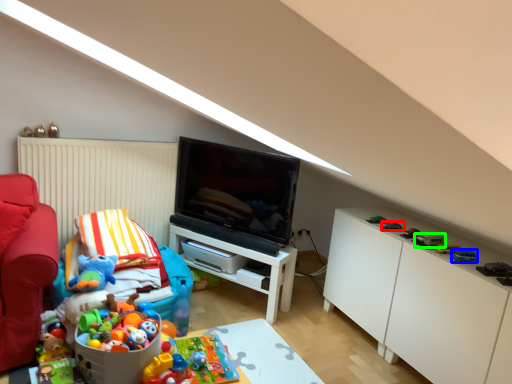
Question: Based on their relative distances, which object is farther from toy (highlighted by a red box)? Choose from toy (highlighted by a blue box) and toy (highlighted by a green box).

Choices:
 (A) toy
 (B) toy

Answer: (A)